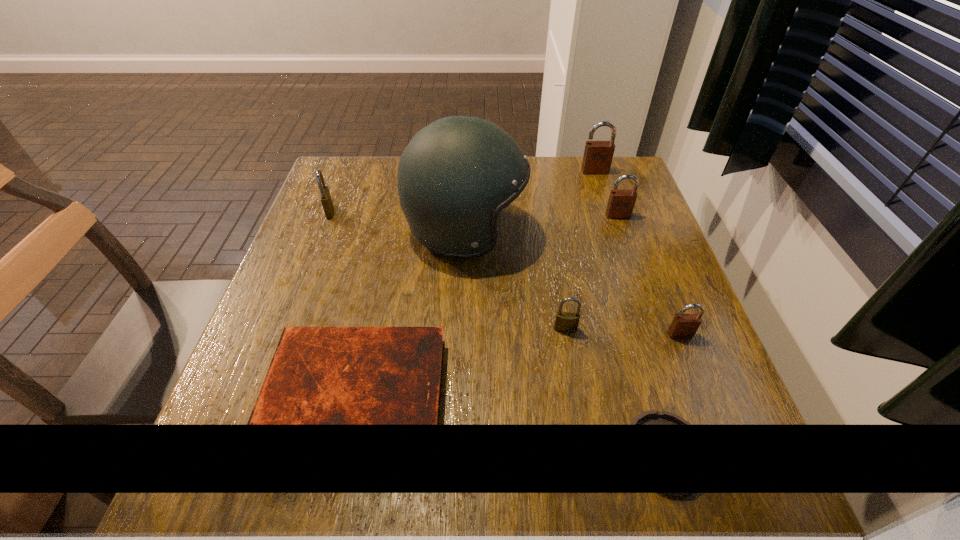
The width and height of the screenshot is (960, 540). I want to click on brown padlock object that ranks as the closest to the Bible, so click(684, 326).

Find the location of `blank space that satisfies the following two spatial constraints: 1. at the face opening of the green football helmet; 2. on the back side of the ashtray`. blank space that satisfies the following two spatial constraints: 1. at the face opening of the green football helmet; 2. on the back side of the ashtray is located at coordinates point(457,451).

Where is `vacant point that satisfies the following two spatial constraints: 1. on the back side of the right brass padlock; 2. at the face opening of the football helmet`? Image resolution: width=960 pixels, height=540 pixels. vacant point that satisfies the following two spatial constraints: 1. on the back side of the right brass padlock; 2. at the face opening of the football helmet is located at coordinates pyautogui.click(x=549, y=232).

Locate an element on the screen. The image size is (960, 540). free spot that satisfies the following two spatial constraints: 1. on the front-facing side of the second nearest brown padlock; 2. at the face opening of the green football helmet is located at coordinates (623, 232).